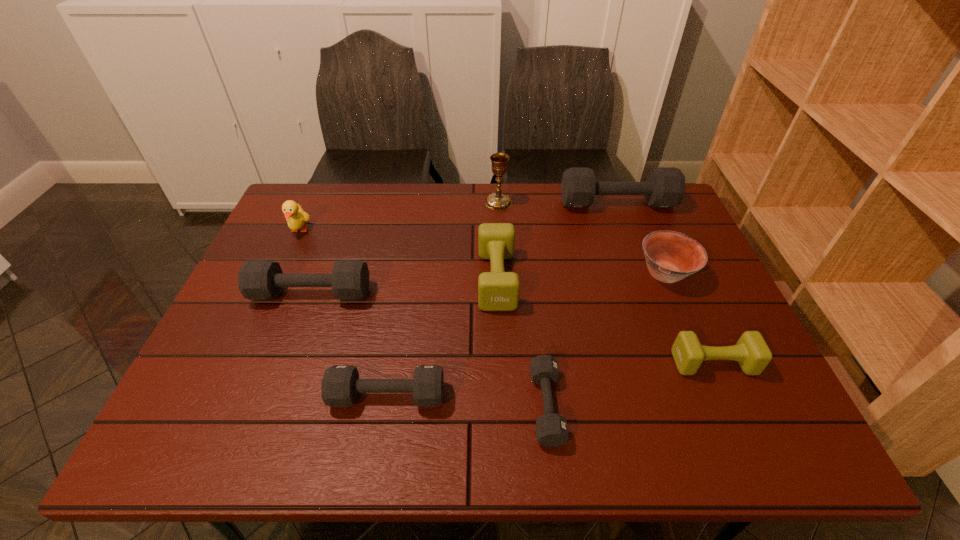
Locate an element on the screen. The height and width of the screenshot is (540, 960). the nearer olive dumbbell is located at coordinates (751, 351).

Where is `the smaller olive dumbbell`? This screenshot has width=960, height=540. the smaller olive dumbbell is located at coordinates (751, 351).

Locate an element on the screen. This screenshot has height=540, width=960. the sixth object from left to right is located at coordinates click(x=551, y=428).

Image resolution: width=960 pixels, height=540 pixels. I want to click on the smallest gray dumbbell, so click(551, 428).

You are a GUI agent. You are given a task and a screenshot of the screen. Output one action in this format:
    pyautogui.click(x=<x>, y=<y>)
    Task: Click on the free space located 0.240m on the right of the tallest object
    
    Given the screenshot: What is the action you would take?
    pyautogui.click(x=586, y=202)

The image size is (960, 540). Find the location of `blank area located on the front of the farthest gray dumbbell`. blank area located on the front of the farthest gray dumbbell is located at coordinates (636, 254).

At what (x,y) coordinates should I click in order to perform the action: click on free space located on the front-facing side of the yellow duckling. Please return your answer as a coordinate pair (x, y). Image resolution: width=960 pixels, height=540 pixels. Looking at the image, I should click on (258, 321).

At what (x,y) coordinates should I click in order to perform the action: click on free space located 0.110m on the left of the bigger olive dumbbell. Please return your answer as a coordinate pair (x, y). Looking at the image, I should click on (438, 279).

Locate an element on the screen. vacant space located on the back of the third nearest gray dumbbell is located at coordinates (337, 225).

You are a GUI agent. You are given a task and a screenshot of the screen. Output one action in this format:
    pyautogui.click(x=<x>, y=<y>)
    Task: Click on the free space located 0.280m on the front of the bowl
    
    Given the screenshot: What is the action you would take?
    [x=714, y=390]